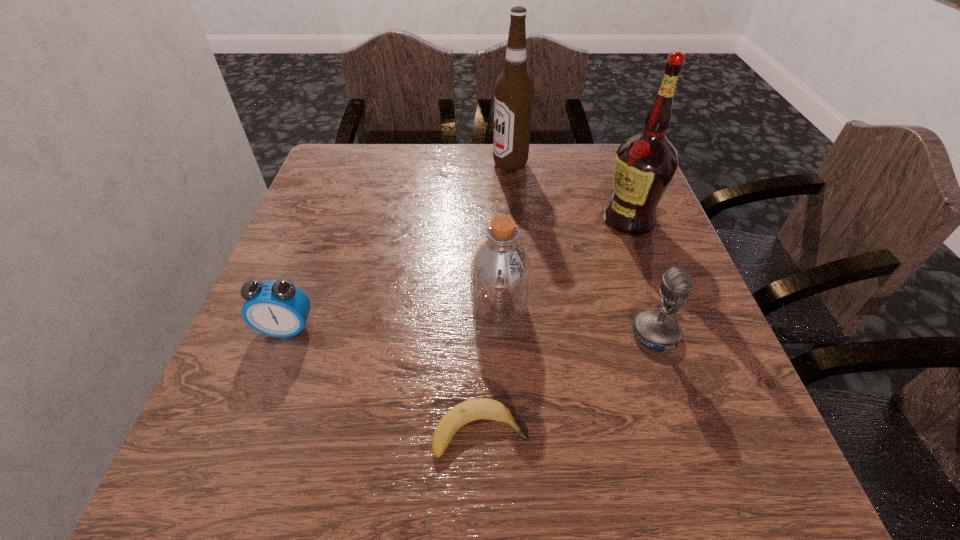
Find the location of a particular element. The image size is (960, 540). vacant space situated 0.220m on the label of the farther alcohol is located at coordinates (412, 164).

The height and width of the screenshot is (540, 960). I want to click on vacant area situated 0.150m on the label of the farther alcohol, so click(x=438, y=164).

This screenshot has width=960, height=540. I want to click on free point located 0.160m on the label of the farther alcohol, so click(434, 164).

In order to click on free location located on the label of the fifth nearest object in this screenshot , I will do `click(499, 219)`.

Find the location of a particular element. Image resolution: width=960 pixels, height=540 pixels. free region located on the label of the fifth nearest object is located at coordinates (431, 219).

The width and height of the screenshot is (960, 540). Find the location of `vacant area situated 0.180m on the label of the fifth nearest object`. vacant area situated 0.180m on the label of the fifth nearest object is located at coordinates (525, 219).

Identify the location of free region located on the front of the third tallest object. (501, 360).

I want to click on blank area located 0.120m on the front-facing side of the fourth tallest object, so click(x=565, y=334).

Find the location of `vacant position located 0.270m on the front-facing side of the fourth tallest object`. vacant position located 0.270m on the front-facing side of the fourth tallest object is located at coordinates (483, 334).

At what (x,y) coordinates should I click in order to perform the action: click on vacant space positioned on the front-facing side of the fourth tallest object. Please return your answer as a coordinate pair (x, y). This screenshot has height=540, width=960. Looking at the image, I should click on (521, 334).